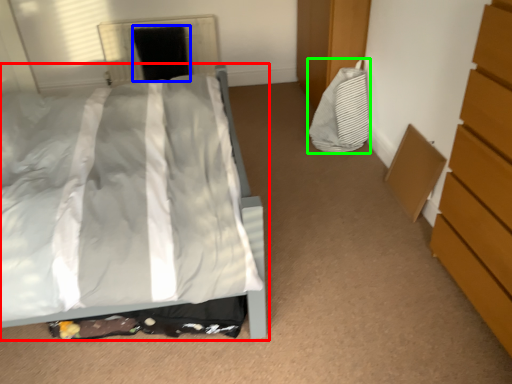
Question: Which object is positioned closest to bed (highlighted by a red box)? Select from screen door (highlighted by a blue box) and material (highlighted by a green box).

Choices:
 (A) screen door
 (B) material

Answer: (B)